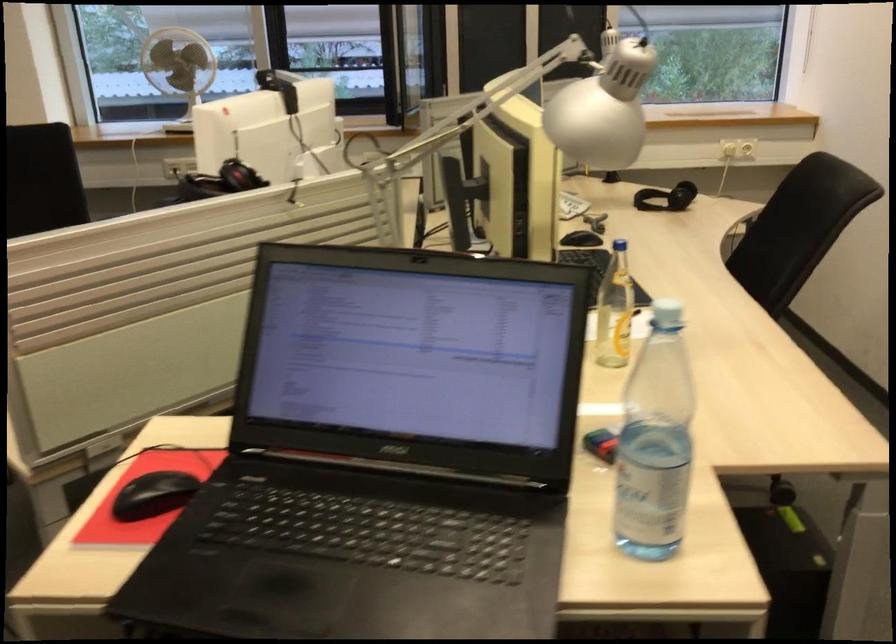
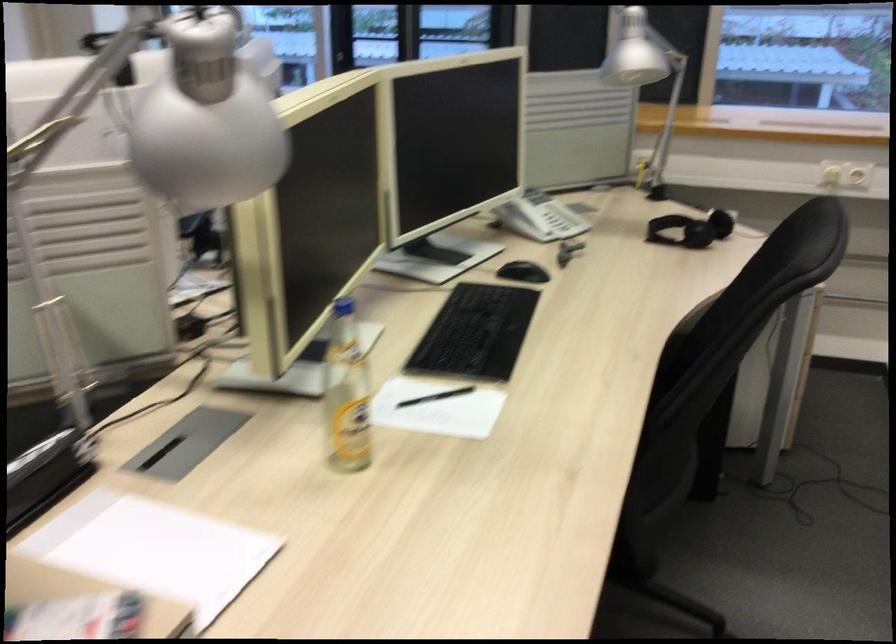
Question: The camera is either moving clockwise (left) or counter-clockwise (right) around the object. The first image is from the beginning of the video and the second image is from the end. Is the camera moving left or right when shooting the video?

Choices:
 (A) Left
 (B) Right

Answer: (B)